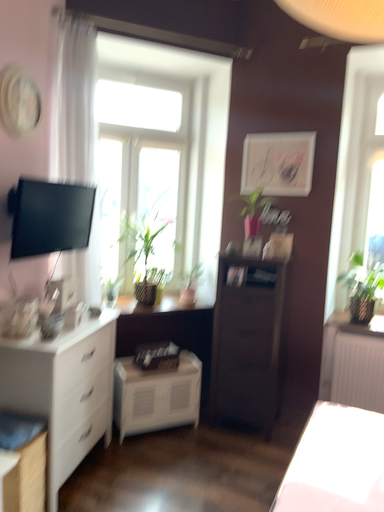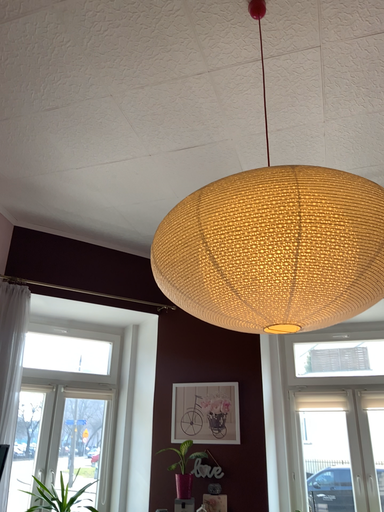
Question: How did the camera likely rotate when shooting the video?

Choices:
 (A) rotated right
 (B) rotated left

Answer: (A)